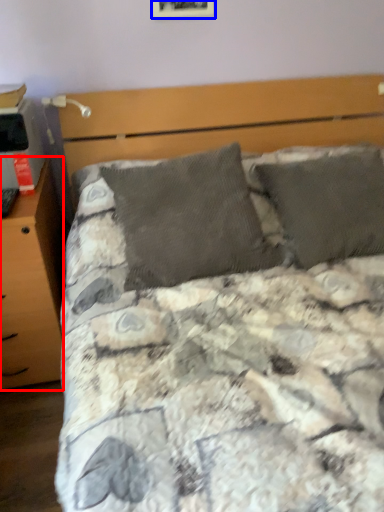
Question: Which object is closer to the camera taking this photo, nightstand (highlighted by a red box) or picture frame (highlighted by a blue box)?

Choices:
 (A) nightstand
 (B) picture frame

Answer: (A)